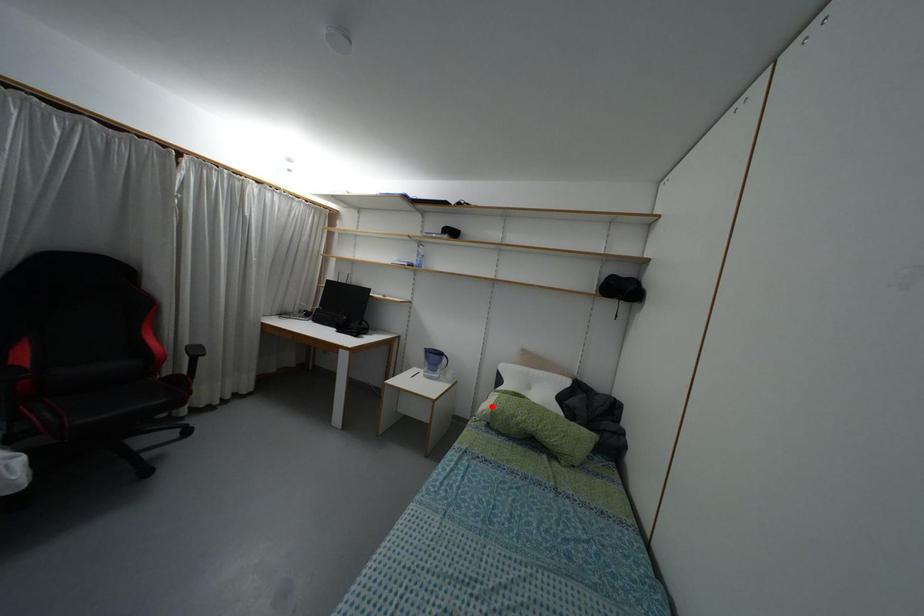
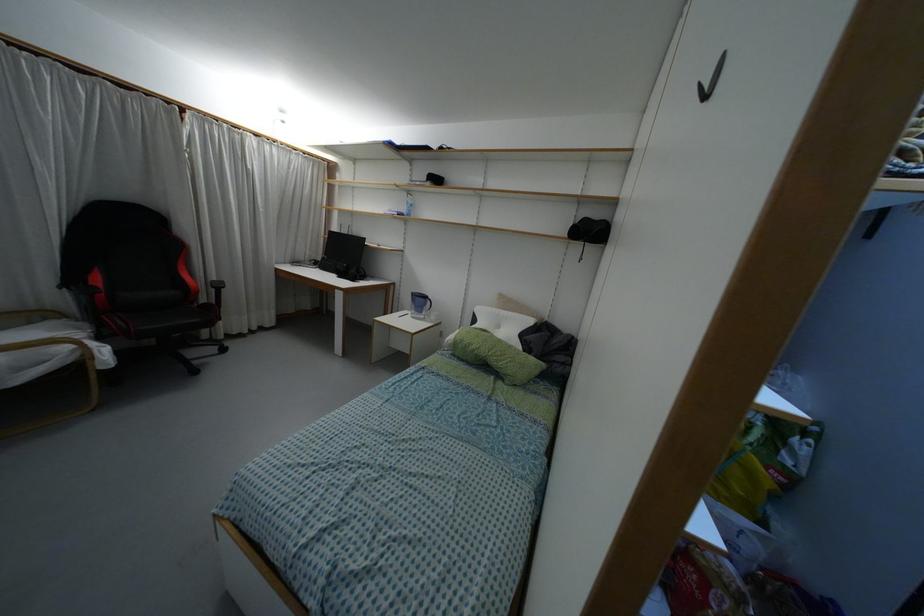
The point at the highlighted location is marked in the first image. Where is the corresponding point in the second image?

(455, 337)